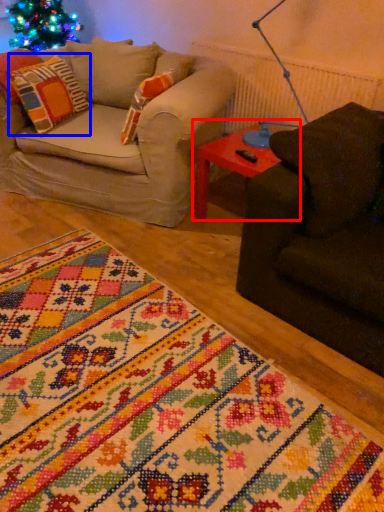
Question: Among these objects, which one is farthest to the camera, table (highlighted by a red box) or pillow (highlighted by a blue box)?

Choices:
 (A) table
 (B) pillow

Answer: (B)